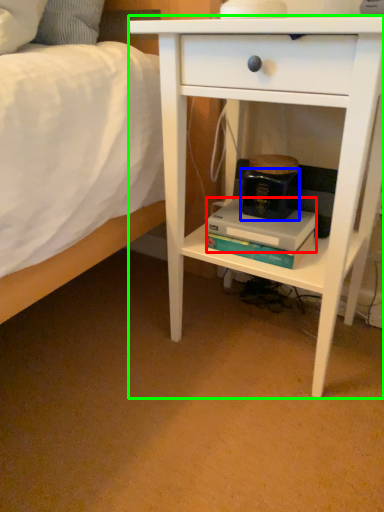
Question: Which object is the farthest from paperback book (highlighted by a red box)? Choose among these: paperback book (highlighted by a blue box) or nightstand (highlighted by a green box).

Choices:
 (A) paperback book
 (B) nightstand

Answer: (B)